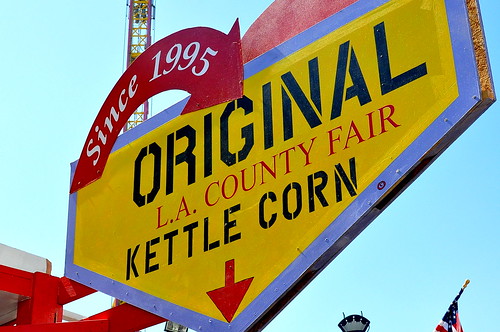
Image resolution: width=500 pixels, height=332 pixels. I want to click on "kettle", so click(x=169, y=247), click(x=189, y=242).